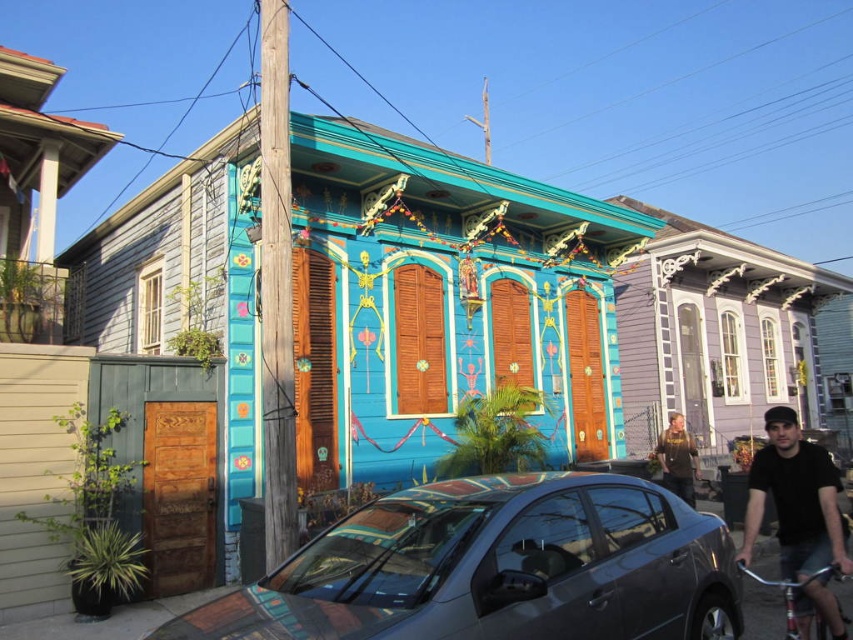
Between point (447, 504) and point (796, 596), which one is positioned in front?

Point (447, 504) is in front.

Identify the location of satin black car at center. (495, 568).

Who is more forward, (525,628) or (677,433)?

Positioned in front is point (525,628).

Which is in front, point (370, 509) or point (680, 456)?

Point (370, 509)

The image size is (853, 640). In order to click on satin black car at center in this screenshot , I will do `click(495, 568)`.

From the picture: Who is positioned more to the left, satin black car at center or black cotton shirt at lower right?

satin black car at center

What are the coordinates of `satin black car at center` in the screenshot? It's located at (495, 568).